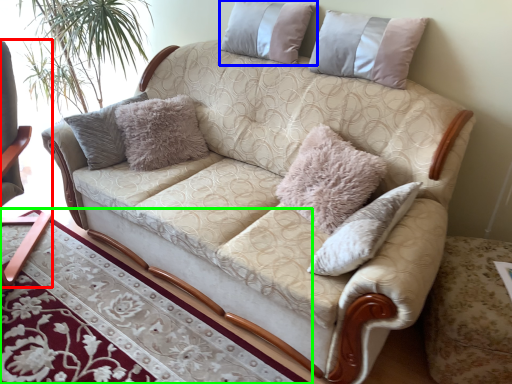
Question: Which object is the farthest from rocking chair (highlighted by a red box)? Choose among these: pillow (highlighted by a blue box) or table (highlighted by a green box).

Choices:
 (A) pillow
 (B) table

Answer: (A)